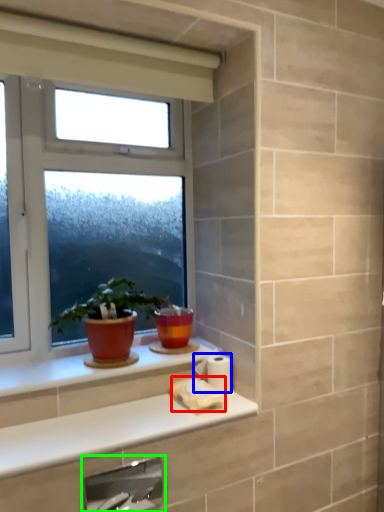
Question: Considering the real-world distances, which object is closest to toilet paper (highlighted by a red box)? toilet paper (highlighted by a blue box) or faucet (highlighted by a green box).

Choices:
 (A) toilet paper
 (B) faucet

Answer: (A)